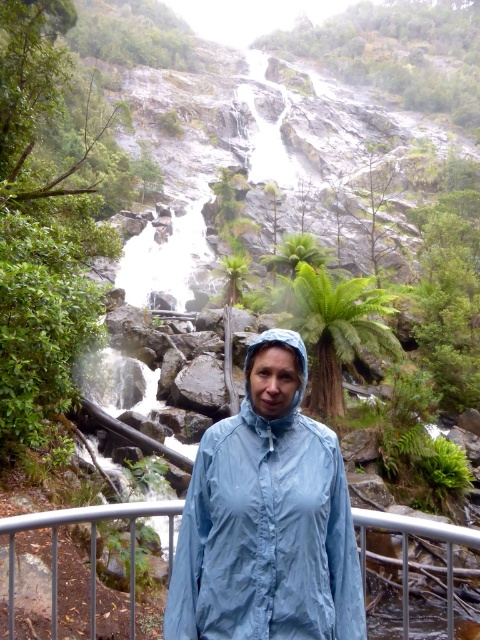
You are a photographer trying to capture the waterfall and the woman in your shot. You notice the light blue nylon jacket at center and the metallic gray rail at lower center. Which object appears taller in the photo?

The light blue nylon jacket at center appears taller than the metallic gray rail at lower center in the photo.

You are a hiker who has just arrived at the waterfall. You notice the light blue nylon jacket at center and the metallic gray rail at lower center. If you want to place your backpack between them, will there be enough space? Please explain.

The light blue nylon jacket at center is 37.82 inches away from the metallic gray rail at lower center. Since the average backpack width is about 15 to 20 inches, there is sufficient space between them to place your backpack.